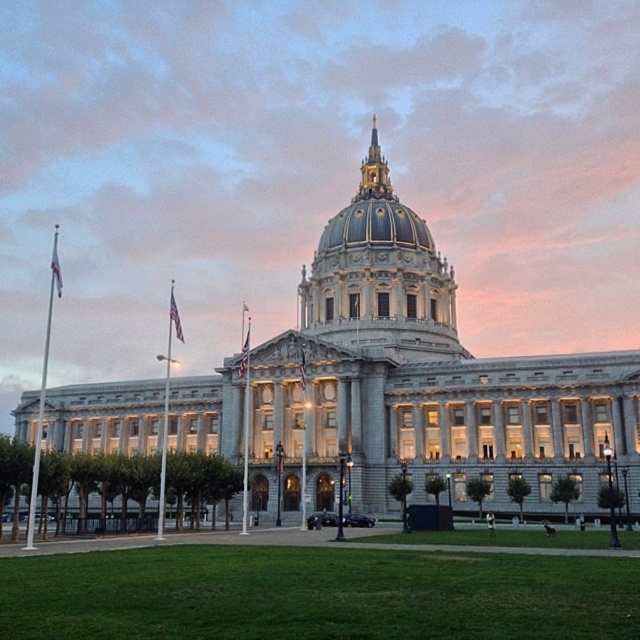
You are standing in front of the grand neoclassical building and want to walk towards the green grass at lower center. Which direction should you move relative to the gray stone building at center?

You should move to the right relative to the gray stone building at center because the green grass at lower center is located to the left of the building, so moving right from the building will lead you towards the grass.